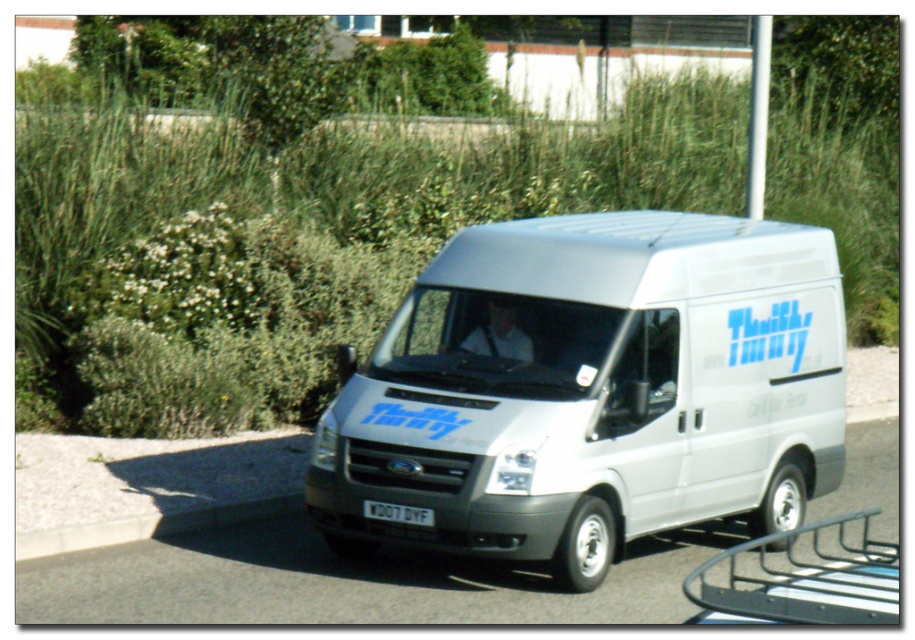
Question: Does black metal bike rack at lower right have a larger size compared to gray concrete curb at lower left?

Choices:
 (A) no
 (B) yes

Answer: (A)

Question: Which of the following is the farthest from the observer?

Choices:
 (A) gray concrete curb at lower left
 (B) black metal bike rack at lower right
 (C) white matte van at center

Answer: (A)

Question: Among these points, which one is nearest to the camera?

Choices:
 (A) (829, 566)
 (B) (212, 509)

Answer: (A)

Question: Among these points, which one is nearest to the camera?

Choices:
 (A) (580, 326)
 (B) (806, 593)
 (C) (55, 532)

Answer: (B)

Question: Can you confirm if white matte van at center is positioned above black metal bike rack at lower right?

Choices:
 (A) yes
 (B) no

Answer: (A)

Question: Can you confirm if black metal bike rack at lower right is thinner than gray concrete curb at lower left?

Choices:
 (A) yes
 (B) no

Answer: (A)